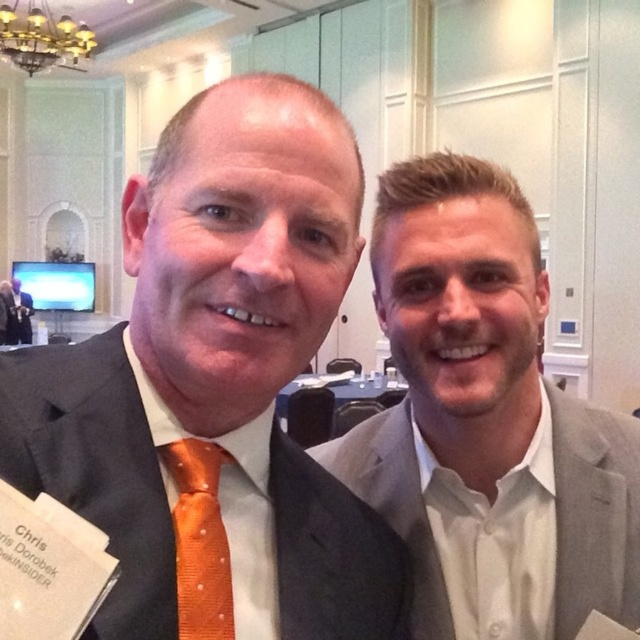
Question: Which object is farther from the camera taking this photo?

Choices:
 (A) matte black suit at center
 (B) gray fabric suit at right
 (C) orange dotted fabric tie at left

Answer: (A)

Question: Is orange silk tie at center bigger than orange dotted fabric tie at left?

Choices:
 (A) no
 (B) yes

Answer: (B)

Question: Which of the following is the farthest from the observer?

Choices:
 (A) pyautogui.click(x=212, y=324)
 (B) pyautogui.click(x=547, y=385)
 (C) pyautogui.click(x=24, y=332)
 (D) pyautogui.click(x=205, y=580)

Answer: (C)

Question: Is orange silk tie at center thinner than matte black suit at center?

Choices:
 (A) no
 (B) yes

Answer: (B)

Question: From the image, what is the correct spatial relationship of orange silk tie at center in relation to matte black suit at center?

Choices:
 (A) above
 (B) below

Answer: (B)

Question: Among these points, which one is nearest to the camera?

Choices:
 (A) (451, 305)
 (B) (17, 301)

Answer: (A)